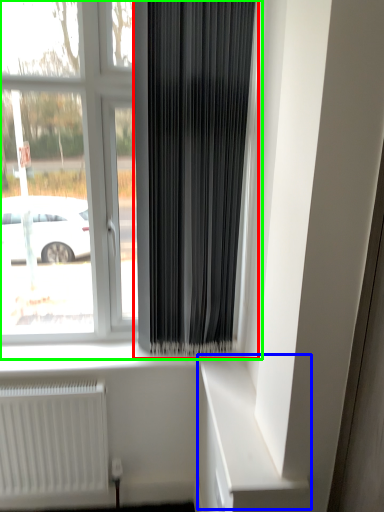
Question: Estimate the real-world distances between objects in this image. Which object is closer to curtain (highlighted by a red box), shelf (highlighted by a blue box) or window (highlighted by a green box)?

Choices:
 (A) shelf
 (B) window

Answer: (B)